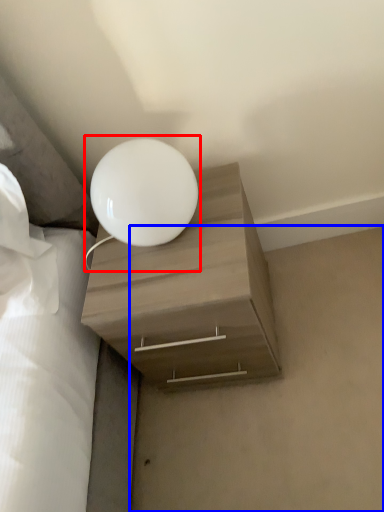
Question: Which of the following is the farthest to the observer, lamp (highlighted by a red box) or concrete (highlighted by a blue box)?

Choices:
 (A) lamp
 (B) concrete

Answer: (B)